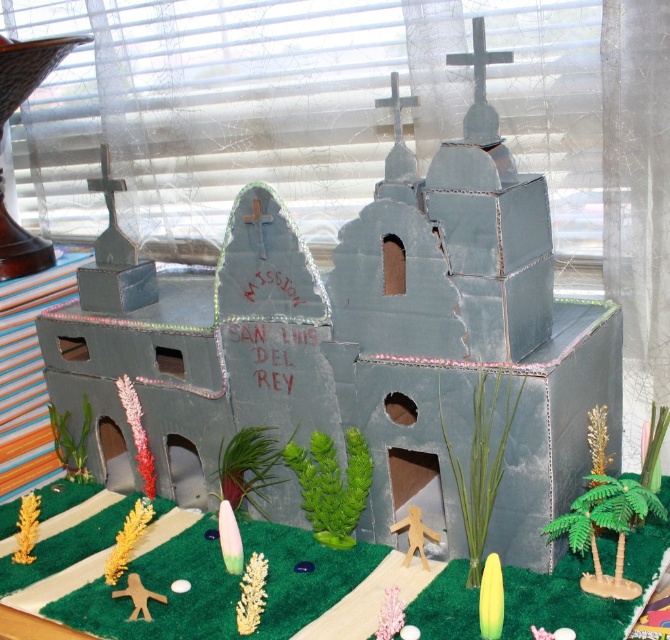
Locate an element on the screen. The height and width of the screenshot is (640, 670). gold textured plant at lower left is located at coordinates (25, 529).

Does gold textured plant at lower left have a greater width compared to wooden stick figure at center?

Yes, gold textured plant at lower left is wider than wooden stick figure at center.

Who is more forward, (27, 518) or (399, 524)?

Point (399, 524) is in front.

Find the location of `gold textured plant at lower left`. gold textured plant at lower left is located at coordinates (25, 529).

Can you confirm if green matte surfboard at lower center is smaller than wooden stick figure at center?

Correct, green matte surfboard at lower center occupies less space than wooden stick figure at center.

At what (x,y) coordinates should I click in order to perform the action: click on green matte surfboard at lower center. Please return your answer as a coordinate pair (x, y). The image size is (670, 640). Looking at the image, I should click on (490, 598).

Where is `green matte surfboard at lower center`? The image size is (670, 640). green matte surfboard at lower center is located at coordinates (490, 598).

Which of these two, green matte plant at center or green felt at center, stands taller?

Standing taller between the two is green matte plant at center.

Does green matte plant at center come in front of green felt at center?

No, green matte plant at center is behind green felt at center.

The height and width of the screenshot is (640, 670). Describe the element at coordinates (332, 484) in the screenshot. I see `green matte plant at center` at that location.

Find the location of a particular element. This screenshot has height=640, width=670. green matte plant at center is located at coordinates (332, 484).